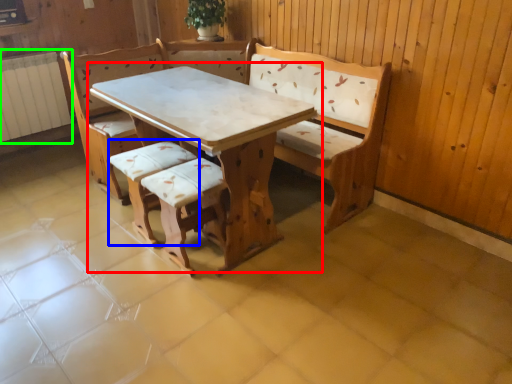
Question: Which is farther away from table (highlighted by a red box)? armchair (highlighted by a blue box) or radiator (highlighted by a green box)?

Choices:
 (A) armchair
 (B) radiator

Answer: (B)